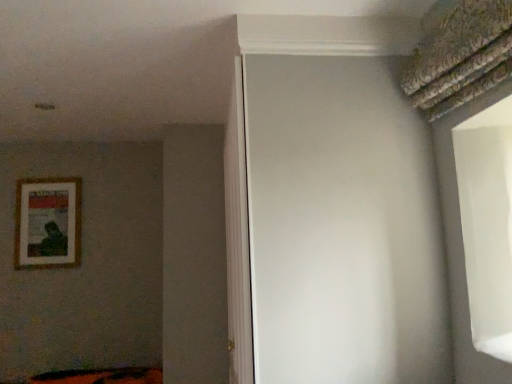
Question: From a real-world perspective, is white matte screen door at center physically below wooden framed poster at left?

Choices:
 (A) no
 (B) yes

Answer: (B)

Question: Is white matte screen door at center bigger than wooden framed poster at left?

Choices:
 (A) yes
 (B) no

Answer: (A)

Question: From a real-world perspective, is white matte screen door at center positioned over wooden framed poster at left based on gravity?

Choices:
 (A) no
 (B) yes

Answer: (A)

Question: Is white matte screen door at center behind wooden framed poster at left?

Choices:
 (A) yes
 (B) no

Answer: (B)

Question: Does white matte screen door at center have a lesser width compared to wooden framed poster at left?

Choices:
 (A) no
 (B) yes

Answer: (A)

Question: From the image's perspective, is white matte screen door at center located beneath wooden framed poster at left?

Choices:
 (A) yes
 (B) no

Answer: (A)

Question: Does wooden framed poster at left appear on the right side of white matte screen door at center?

Choices:
 (A) no
 (B) yes

Answer: (A)

Question: Considering the relative sizes of wooden framed poster at left and white matte screen door at center in the image provided, is wooden framed poster at left thinner than white matte screen door at center?

Choices:
 (A) yes
 (B) no

Answer: (A)

Question: From a real-world perspective, is wooden framed poster at left physically below white matte screen door at center?

Choices:
 (A) yes
 (B) no

Answer: (B)

Question: Does wooden framed poster at left have a greater height compared to white matte screen door at center?

Choices:
 (A) yes
 (B) no

Answer: (B)

Question: From a real-world perspective, is wooden framed poster at left located higher than white matte screen door at center?

Choices:
 (A) no
 (B) yes

Answer: (B)

Question: Is the depth of wooden framed poster at left less than that of white matte screen door at center?

Choices:
 (A) no
 (B) yes

Answer: (A)

Question: From the image's perspective, is white matte screen door at center positioned above or below wooden framed poster at left?

Choices:
 (A) below
 (B) above

Answer: (A)